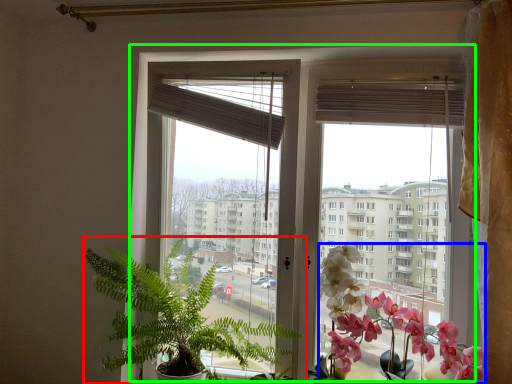
Question: Which object is the closest to the houseplant (highlighted by a red box)? Choose among these: flower (highlighted by a blue box) or window (highlighted by a green box).

Choices:
 (A) flower
 (B) window

Answer: (B)